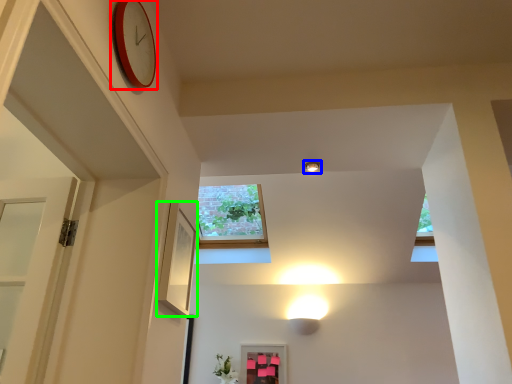
Question: Considering the real-world distances, which object is closest to clock (highlighted by a red box)? light fixture (highlighted by a blue box) or picture frame (highlighted by a green box).

Choices:
 (A) light fixture
 (B) picture frame

Answer: (B)